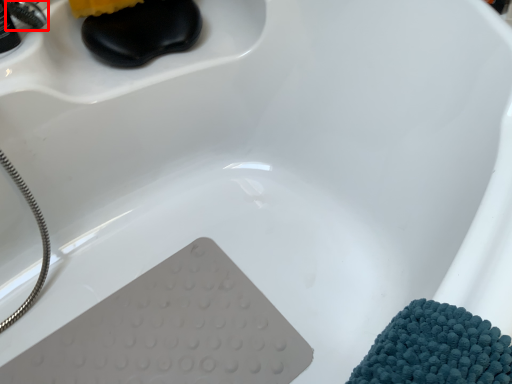
Question: From the image's perspective, considering the relative positions of faucet (annotated by the red box) and faucet in the image provided, where is faucet (annotated by the red box) located with respect to the staircase?

Choices:
 (A) above
 (B) below

Answer: (A)